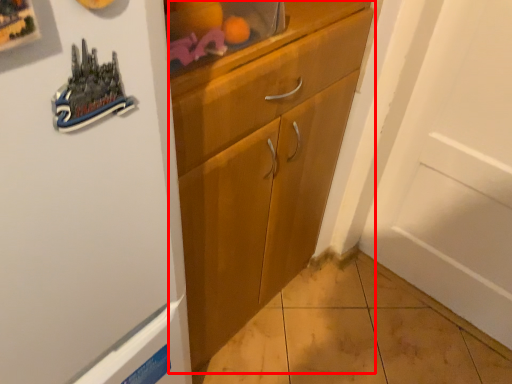
Question: Observing the image, what is the correct spatial positioning of cabinetry (annotated by the red box) in reference to shelf?

Choices:
 (A) left
 (B) right

Answer: (A)